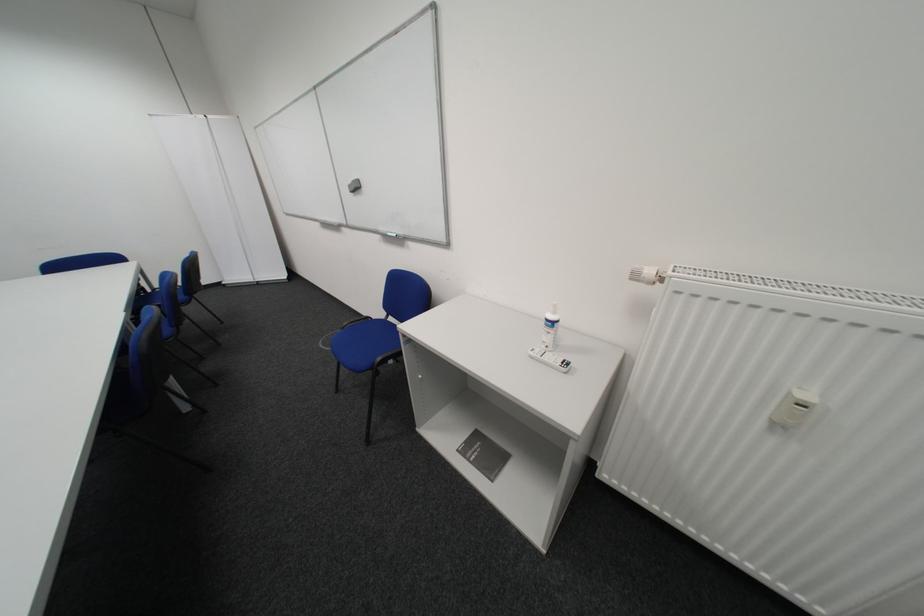
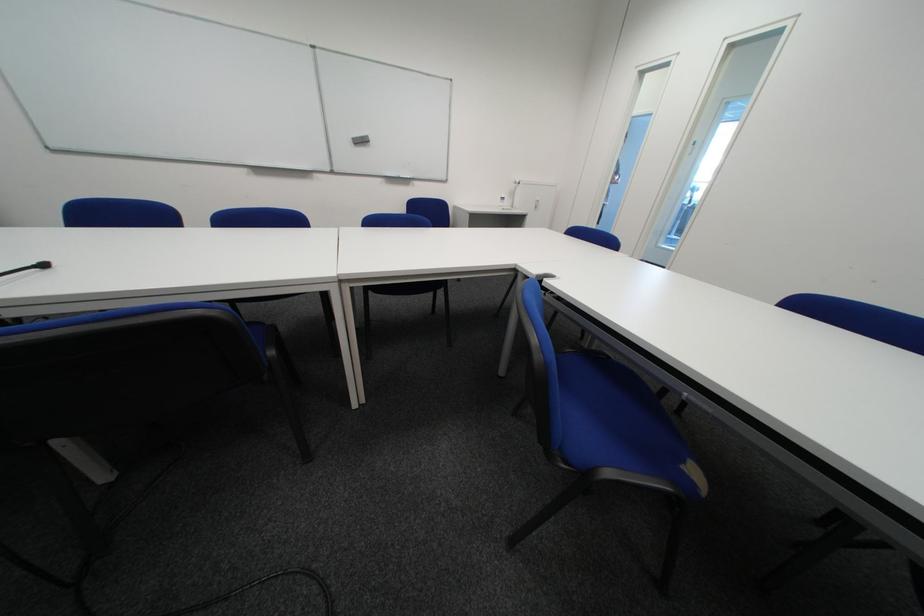
The point at (361,188) is marked in the first image. Where is the corresponding point in the second image?

(365, 140)